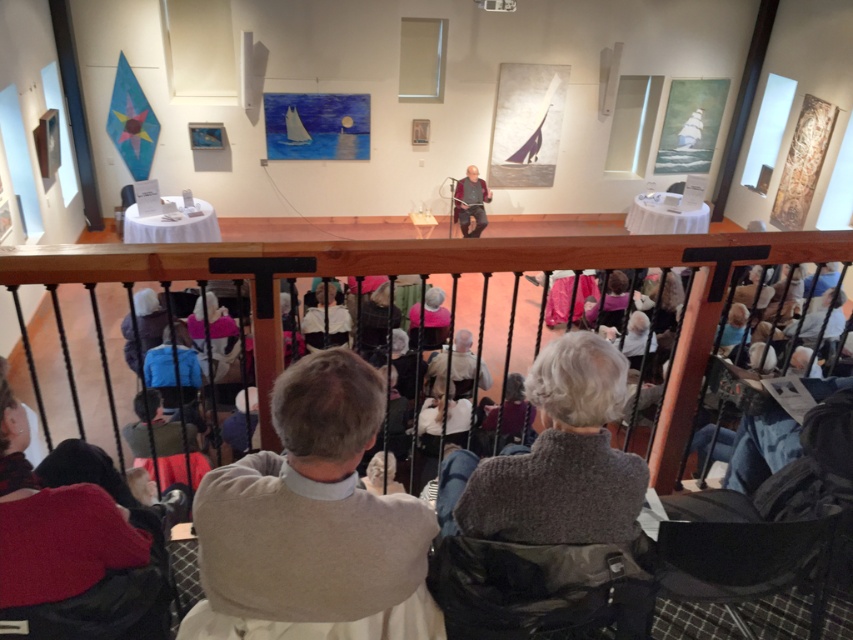
Question: Which point is closer to the camera taking this photo?

Choices:
 (A) (76, 280)
 (B) (463, 220)

Answer: (A)

Question: Observing the image, what is the correct spatial positioning of wooden railing at center in reference to dark brown leather jacket at center?

Choices:
 (A) below
 (B) above

Answer: (A)

Question: In this image, where is wooden railing at center located relative to dark brown leather jacket at center?

Choices:
 (A) left
 (B) right

Answer: (A)

Question: Which point is farther to the camera?

Choices:
 (A) wooden railing at center
 (B) dark brown leather jacket at center

Answer: (B)

Question: Is wooden railing at center positioned before dark brown leather jacket at center?

Choices:
 (A) no
 (B) yes

Answer: (B)

Question: Among these objects, which one is farthest from the camera?

Choices:
 (A) wooden railing at center
 (B) dark brown leather jacket at center

Answer: (B)